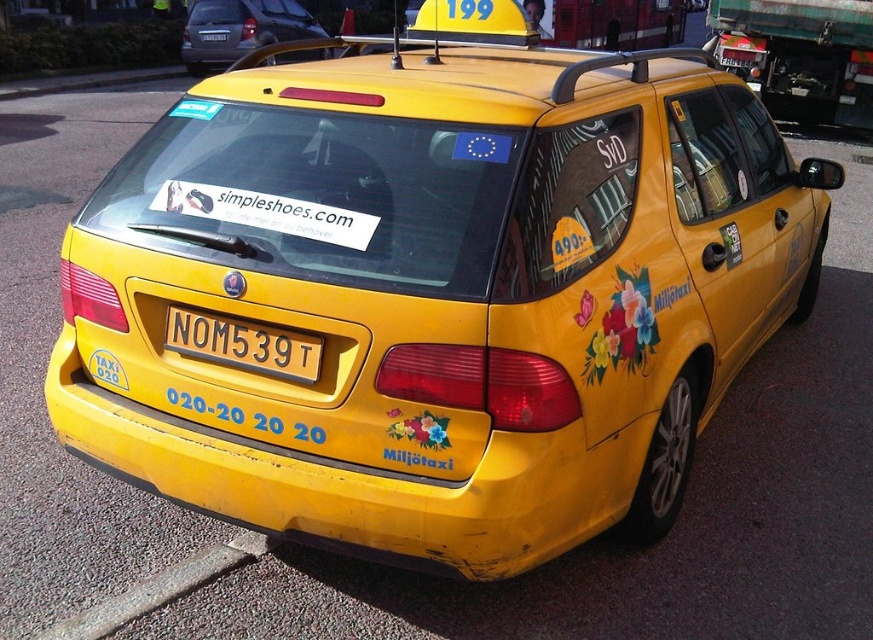
You are a delivery person who needs to place a package on the roof of the yellow matte taxi at upper center. The package is 15 feet long. Can you safely place it without it overlapping the yellow plastic license plate at center?

The yellow matte taxi at upper center is 15.22 feet from the yellow plastic license plate at center. Since the package is 15 feet long, it can be placed safely without overlapping the license plate as there is enough space.

You are a delivery person who needs to deliver a package to the taxi driver. The package is too large to fit in the trunk, so you have to place it on top of the vehicle. However, there are strict city regulations that prohibit placing items on certain parts of the vehicle to avoid obstructing important information. According to the image, where exactly on the yellow matte taxi at upper center should you avoid placing the package to ensure the yellow plastic license plate at center remains visible?

You should avoid placing the package on the area of the yellow matte taxi at upper center where the yellow plastic license plate at center is located, as this would obstruct the license plate, which is required to be visible by law.

You are a delivery driver who needs to park your truck next to the gray asphalt curb at lower left. The yellow matte taxi at upper center is blocking the path. Can you move the taxi to make space?

The yellow matte taxi at upper center is above the gray asphalt curb at lower left, so moving the taxi would allow access to the curb.